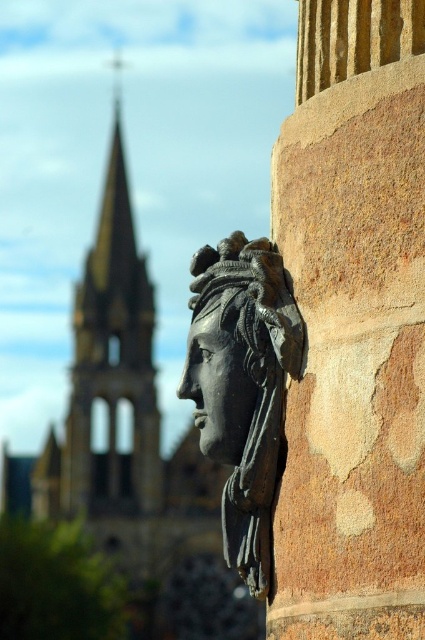
Consider the image. You are standing in front of the sculpted head on the stone wall and notice two points marked on the sculpture. The first point is at coordinates point (365, 324) and the second point is at point (261, 506). Which of these points is nearer to your eyes?

Point (365, 324) is closer to the viewer than point (261, 506).

You are an architect analyzing the image of a sculpted head on a stone wall. You notice a golden stone tower at left and a black polished stone face at center. Which object is taller in the image?

The golden stone tower at left is taller than the black polished stone face at center.

You are an art conservator examining the sculpture. You notice the black stone head at center and the black polished stone face at center. Which one is positioned to the right?

The black stone head at center is positioned to the right of the black polished stone face at center.